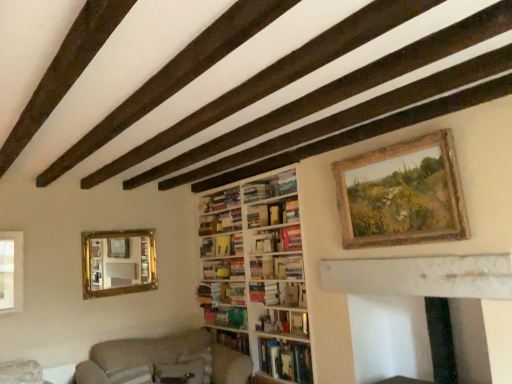
Question: Is beige fabric couch at lower left to the right of wooden bookshelf at center from the viewer's perspective?

Choices:
 (A) yes
 (B) no

Answer: (B)

Question: Could you tell me if beige fabric couch at lower left is turned towards wooden bookshelf at center?

Choices:
 (A) yes
 (B) no

Answer: (B)

Question: Does beige fabric couch at lower left have a lesser height compared to wooden bookshelf at center?

Choices:
 (A) yes
 (B) no

Answer: (B)

Question: Is beige fabric couch at lower left behind wooden bookshelf at center?

Choices:
 (A) yes
 (B) no

Answer: (B)

Question: Would you say beige fabric couch at lower left is outside wooden bookshelf at center?

Choices:
 (A) no
 (B) yes

Answer: (B)

Question: Based on their sizes in the image, would you say hardcover books at center, which is the 5th book in bottom-to-top order, is bigger or smaller than hardcover book at center, which is counted as the sixth book, starting from the top?

Choices:
 (A) small
 (B) big

Answer: (B)

Question: Choose the correct answer: Is hardcover books at center, which is the 5th book in bottom-to-top order, inside hardcover book at center, which is the fourth book from bottom to top, or outside it?

Choices:
 (A) inside
 (B) outside

Answer: (B)

Question: From a real-world perspective, is hardcover books at center, the fifth book in the top-to-bottom sequence, physically located above or below hardcover book at center, which is counted as the sixth book, starting from the top?

Choices:
 (A) below
 (B) above

Answer: (B)

Question: Is point (276, 243) positioned closer to the camera than point (267, 291)?

Choices:
 (A) closer
 (B) farther

Answer: (A)

Question: From a real-world perspective, relative to hardcover books at center, which is the 5th book in bottom-to-top order, is hardcover book at center, which is the fourth book from bottom to top, vertically above or below?

Choices:
 (A) above
 (B) below

Answer: (B)

Question: Is hardcover book at center, which is counted as the sixth book, starting from the top, taller or shorter than hardcover books at center, the fifth book in the top-to-bottom sequence?

Choices:
 (A) short
 (B) tall

Answer: (A)

Question: Is hardcover book at center, which is the fourth book from bottom to top, spatially inside hardcover books at center, which is the 5th book in bottom-to-top order, or outside of it?

Choices:
 (A) inside
 (B) outside

Answer: (B)

Question: Visually, is hardcover book at center, which is counted as the sixth book, starting from the top, positioned to the left or to the right of hardcover books at center, which is the 5th book in bottom-to-top order?

Choices:
 (A) right
 (B) left

Answer: (B)

Question: Is hardcover book at center, which is counted as the 3th book, starting from the bottom, in front of or behind wooden rustic frame at upper right in the image?

Choices:
 (A) front
 (B) behind

Answer: (B)

Question: In terms of height, does hardcover book at center, which is counted as the 3th book, starting from the bottom, look taller or shorter compared to wooden rustic frame at upper right?

Choices:
 (A) short
 (B) tall

Answer: (A)